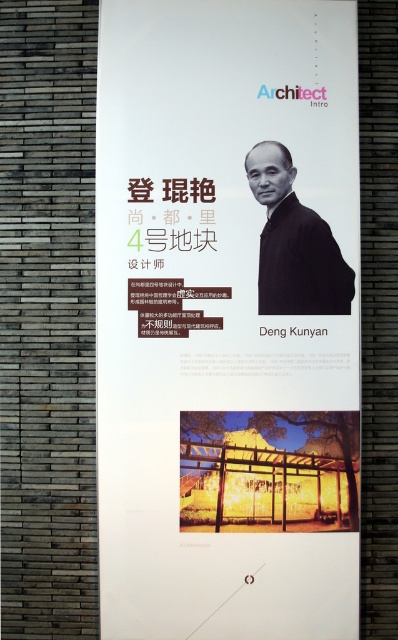
Is matte black portrait at upper center above black matte jacket at upper right?

No.

Is matte black portrait at upper center to the left of black matte jacket at upper right from the viewer's perspective?

Indeed, matte black portrait at upper center is positioned on the left side of black matte jacket at upper right.

Where is `matte black portrait at upper center`? The image size is (398, 640). matte black portrait at upper center is located at coordinates coord(228,317).

At what (x,y) coordinates should I click in order to perform the action: click on matte black portrait at upper center. Please return your answer as a coordinate pair (x, y). This screenshot has height=640, width=398. Looking at the image, I should click on (228, 317).